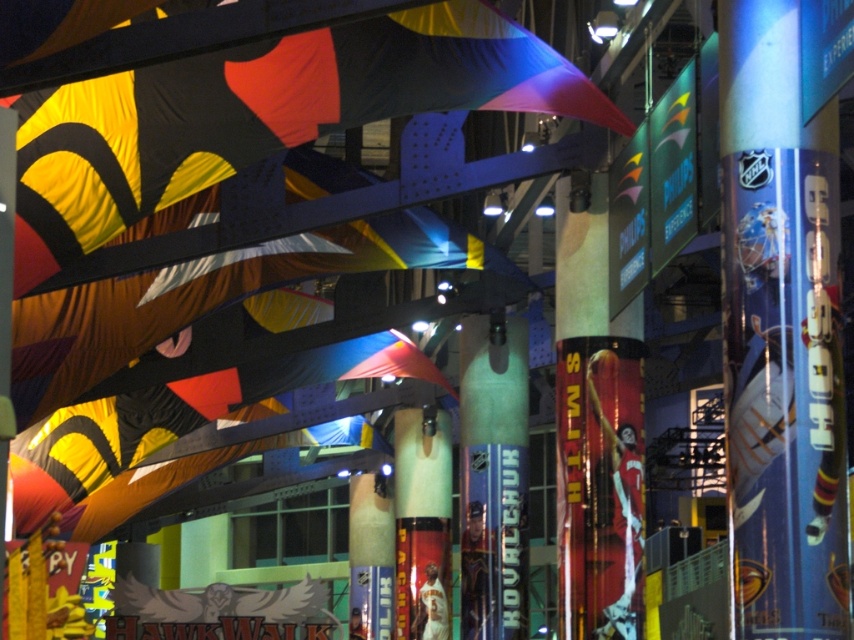
Question: Which point is closer to the camera taking this photo?

Choices:
 (A) (782, 284)
 (B) (495, 548)

Answer: (A)

Question: Among these objects, which one is farthest from the camera?

Choices:
 (A) green glossy pillar at center
 (B) metallic blue hockey stick at center

Answer: (A)

Question: Does metallic blue hockey stick at center appear on the right side of green glossy pillar at center?

Choices:
 (A) no
 (B) yes

Answer: (B)

Question: Considering the relative positions of matte fabric flag at upper center and green glossy pillar at center in the image provided, where is matte fabric flag at upper center located with respect to green glossy pillar at center?

Choices:
 (A) below
 (B) above

Answer: (B)

Question: Considering the relative positions of metallic blue hockey stick at center and matte fabric flag at upper center in the image provided, where is metallic blue hockey stick at center located with respect to matte fabric flag at upper center?

Choices:
 (A) below
 (B) above

Answer: (A)

Question: Among these objects, which one is farthest from the camera?

Choices:
 (A) matte fabric flag at upper center
 (B) metallic blue hockey stick at center

Answer: (A)